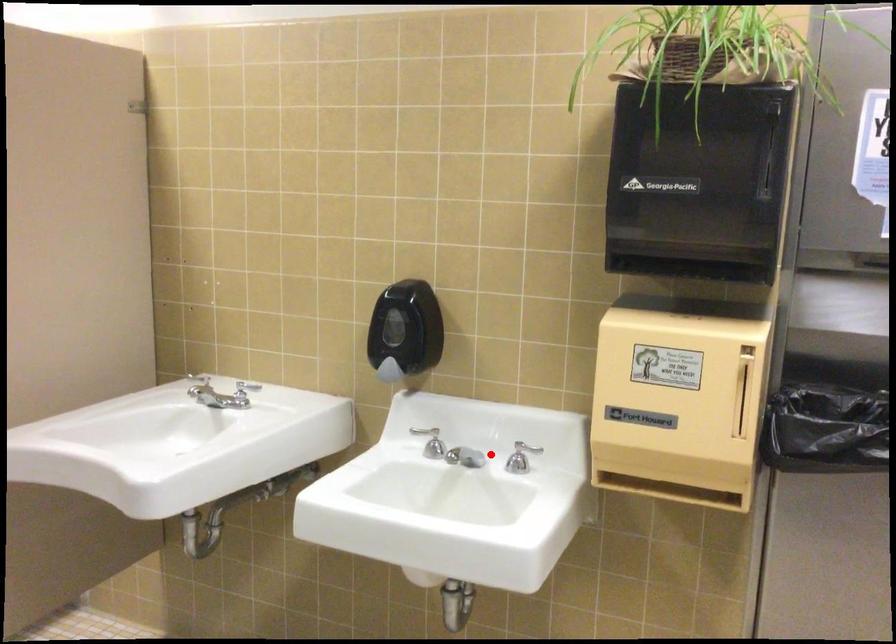
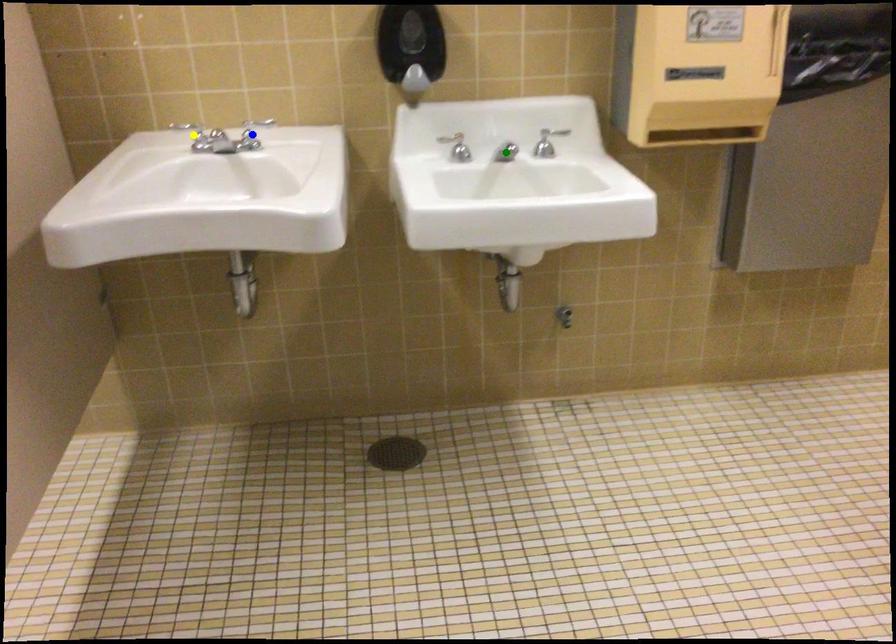
Question: I am providing you with two images of the same scene from different viewpoints. A red point is marked on the first image. You are given multiple points on the second image. In image 2, which mark is for the same physical point as the one in image 1?

Choices:
 (A) blue point
 (B) green point
 (C) yellow point

Answer: (B)